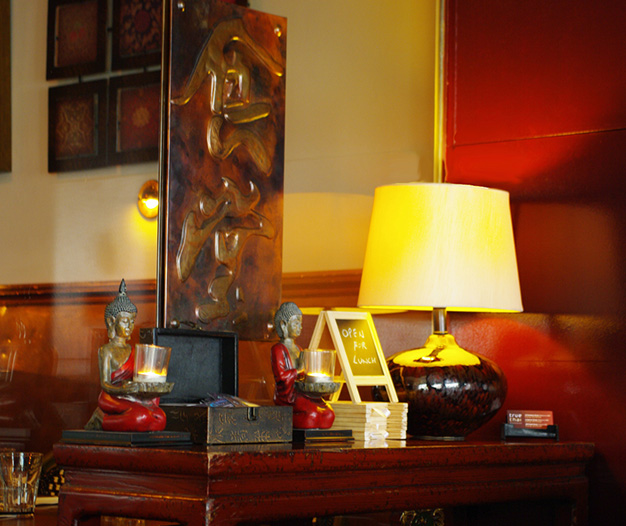
At what (x,y) coordinates should I click in order to perform the action: click on wood box. Please return your answer as a coordinate pair (x, y). Looking at the image, I should click on (233, 427).